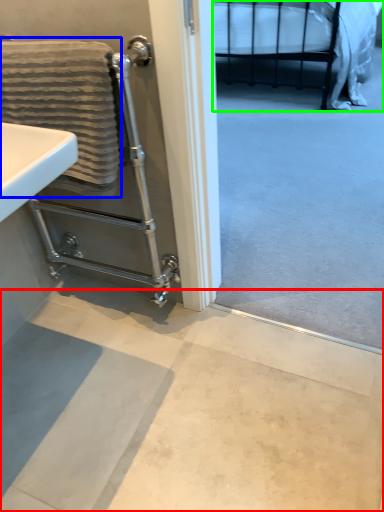
Question: Which is nearer to the concrete (highlighted by a red box)? bath towel (highlighted by a blue box) or bed (highlighted by a green box).

Choices:
 (A) bath towel
 (B) bed

Answer: (A)